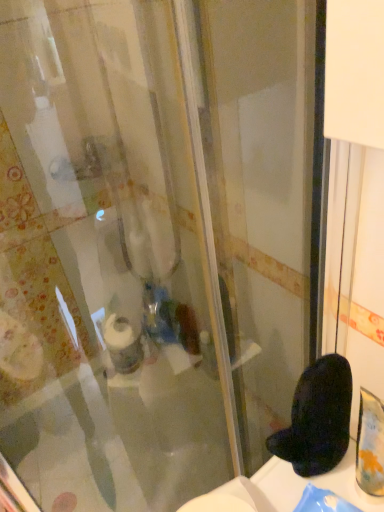
This screenshot has height=512, width=384. I want to click on black fuzzy slipper at lower right, so click(x=317, y=418).

The height and width of the screenshot is (512, 384). What do you see at coordinates (317, 418) in the screenshot? I see `black fuzzy slipper at lower right` at bounding box center [317, 418].

What is the approximate height of black fuzzy slipper at lower right?

7.97 inches.

What do you see at coordinates (122, 344) in the screenshot? The image size is (384, 512). I see `white matte toilet paper at center` at bounding box center [122, 344].

This screenshot has height=512, width=384. I want to click on white matte toilet paper at center, so click(122, 344).

Identify the location of black fuzzy slipper at lower right. (317, 418).

Considering the relative positions of white matte toilet paper at center and black fuzzy slipper at lower right in the image provided, is white matte toilet paper at center to the left of black fuzzy slipper at lower right from the viewer's perspective?

Correct, you'll find white matte toilet paper at center to the left of black fuzzy slipper at lower right.

From the picture: Relative to black fuzzy slipper at lower right, is white matte toilet paper at center in front or behind?

Visually, white matte toilet paper at center is located behind black fuzzy slipper at lower right.

Considering the positions of points (127, 370) and (289, 438), is point (127, 370) closer to camera compared to point (289, 438)?

No, it is not.

From the image's perspective, is white matte toilet paper at center located above or below black fuzzy slipper at lower right?

Clearly, from the image's perspective, white matte toilet paper at center is below black fuzzy slipper at lower right.

From a real-world perspective, relative to black fuzzy slipper at lower right, is white matte toilet paper at center vertically above or below?

From a real-world perspective, white matte toilet paper at center is physically below black fuzzy slipper at lower right.

Does white matte toilet paper at center have a greater width compared to black fuzzy slipper at lower right?

No, white matte toilet paper at center is not wider than black fuzzy slipper at lower right.

Which of these two, white matte toilet paper at center or black fuzzy slipper at lower right, stands taller?

With more height is white matte toilet paper at center.

Looking at the image, does white matte toilet paper at center seem bigger or smaller compared to black fuzzy slipper at lower right?

In the image, white matte toilet paper at center appears to be larger than black fuzzy slipper at lower right.

Which is correct: white matte toilet paper at center is inside black fuzzy slipper at lower right, or outside of it?

white matte toilet paper at center is outside black fuzzy slipper at lower right.

Is white matte toilet paper at center not near black fuzzy slipper at lower right?

No, white matte toilet paper at center is in close proximity to black fuzzy slipper at lower right.

Consider the image. Is white matte toilet paper at center facing away from black fuzzy slipper at lower right?

No.

How many degrees apart are the facing directions of white matte toilet paper at center and black fuzzy slipper at lower right?

There is a 97.6-degree angle between the facing directions of white matte toilet paper at center and black fuzzy slipper at lower right.

Measure the distance between white matte toilet paper at center and black fuzzy slipper at lower right.

white matte toilet paper at center is 14.36 inches away from black fuzzy slipper at lower right.

Where is `footwear that appears on the right of white matte toilet paper at center`? This screenshot has height=512, width=384. footwear that appears on the right of white matte toilet paper at center is located at coordinates (317, 418).

Can you confirm if black fuzzy slipper at lower right is positioned to the right of white matte toilet paper at center?

Indeed, black fuzzy slipper at lower right is positioned on the right side of white matte toilet paper at center.

Is black fuzzy slipper at lower right positioned before white matte toilet paper at center?

Yes, it is in front of white matte toilet paper at center.

Considering the positions of points (312, 435) and (140, 360), is point (312, 435) closer to camera compared to point (140, 360)?

Yes, it is.

From the image's perspective, is black fuzzy slipper at lower right beneath white matte toilet paper at center?

No, from the image's perspective, black fuzzy slipper at lower right is not below white matte toilet paper at center.

In the scene shown: From a real-world perspective, between black fuzzy slipper at lower right and white matte toilet paper at center, who is vertically lower?

white matte toilet paper at center.

Which of these two, black fuzzy slipper at lower right or white matte toilet paper at center, is thinner?

white matte toilet paper at center is thinner.

Consider the image. Is black fuzzy slipper at lower right taller than white matte toilet paper at center?

In fact, black fuzzy slipper at lower right may be shorter than white matte toilet paper at center.

In terms of size, does black fuzzy slipper at lower right appear bigger or smaller than white matte toilet paper at center?

black fuzzy slipper at lower right is smaller than white matte toilet paper at center.

Does black fuzzy slipper at lower right contain white matte toilet paper at center?

No, white matte toilet paper at center is located outside of black fuzzy slipper at lower right.

Based on the photo, can you see black fuzzy slipper at lower right touching white matte toilet paper at center?

No, black fuzzy slipper at lower right is not next to white matte toilet paper at center.

From the picture: Is black fuzzy slipper at lower right positioned with its back to white matte toilet paper at center?

black fuzzy slipper at lower right does not have its back to white matte toilet paper at center.

Where is `footwear on the right of white matte toilet paper at center`? footwear on the right of white matte toilet paper at center is located at coordinates (317, 418).

Image resolution: width=384 pixels, height=512 pixels. I want to click on footwear that is on the right side of white matte toilet paper at center, so pyautogui.click(x=317, y=418).

Identify the location of footwear that appears above the white matte toilet paper at center (from the image's perspective). (317, 418).